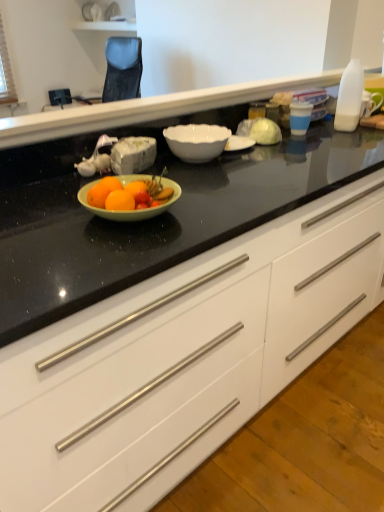
Question: Is white glossy bowl at center shorter than black glossy countertop at center?

Choices:
 (A) no
 (B) yes

Answer: (B)

Question: Considering the relative sizes of white glossy bowl at center and black glossy countertop at center in the image provided, is white glossy bowl at center smaller than black glossy countertop at center?

Choices:
 (A) yes
 (B) no

Answer: (A)

Question: Would you say black glossy countertop at center is part of white glossy bowl at center's contents?

Choices:
 (A) yes
 (B) no

Answer: (B)

Question: Is white glossy bowl at center facing towards black glossy countertop at center?

Choices:
 (A) no
 (B) yes

Answer: (A)

Question: Is white glossy bowl at center behind black glossy countertop at center?

Choices:
 (A) yes
 (B) no

Answer: (A)

Question: From a real-world perspective, is white glossy cabinet at center physically located above or below black glossy countertop at center?

Choices:
 (A) below
 (B) above

Answer: (A)

Question: Is point click(x=228, y=283) closer or farther from the camera than point click(x=322, y=86)?

Choices:
 (A) closer
 (B) farther

Answer: (A)

Question: Is white glossy cabinet at center in front of or behind black glossy countertop at center in the image?

Choices:
 (A) front
 (B) behind

Answer: (A)

Question: Do you think white glossy cabinet at center is within black glossy countertop at center, or outside of it?

Choices:
 (A) inside
 (B) outside

Answer: (B)

Question: From a real-world perspective, is white glossy bowl at center physically located above or below white glossy cabinet at center?

Choices:
 (A) below
 (B) above

Answer: (B)

Question: Looking at the image, does white glossy bowl at center seem bigger or smaller compared to white glossy cabinet at center?

Choices:
 (A) small
 (B) big

Answer: (A)

Question: Considering the positions of white glossy bowl at center and white glossy cabinet at center in the image, is white glossy bowl at center taller or shorter than white glossy cabinet at center?

Choices:
 (A) tall
 (B) short

Answer: (B)

Question: Choose the correct answer: Is white glossy bowl at center inside white glossy cabinet at center or outside it?

Choices:
 (A) inside
 (B) outside

Answer: (A)

Question: Considering the positions of black glossy countertop at center and white glossy cabinet at center in the image, is black glossy countertop at center taller or shorter than white glossy cabinet at center?

Choices:
 (A) short
 (B) tall

Answer: (A)

Question: Looking at their shapes, would you say black glossy countertop at center is wider or thinner than white glossy cabinet at center?

Choices:
 (A) wide
 (B) thin

Answer: (B)